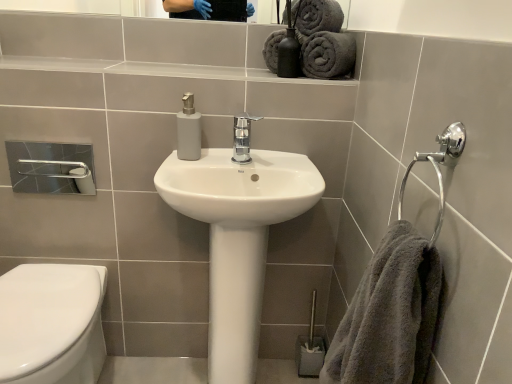
Where is `free space underneath clear glass mirror at upper center (from a real-world perspective)`? free space underneath clear glass mirror at upper center (from a real-world perspective) is located at coordinates (182, 55).